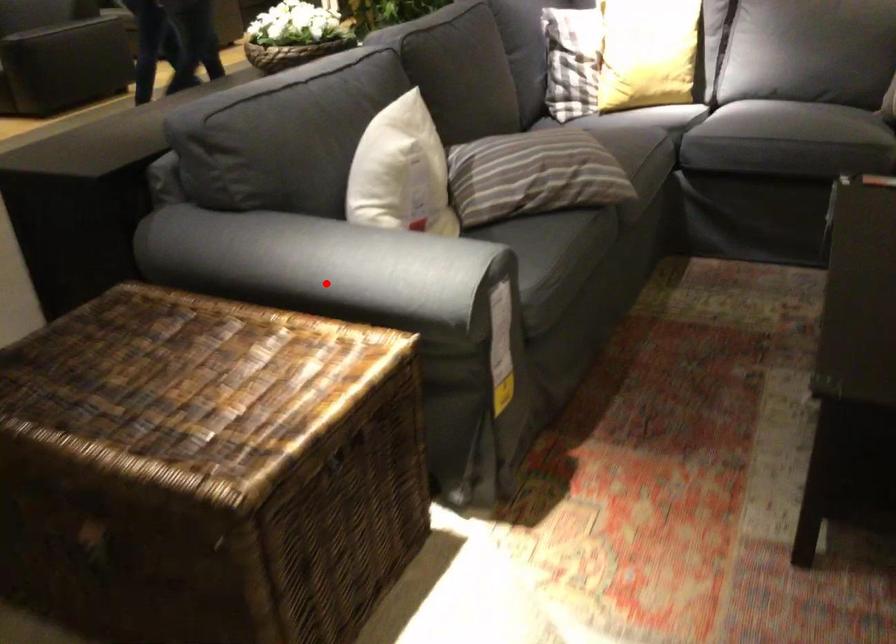
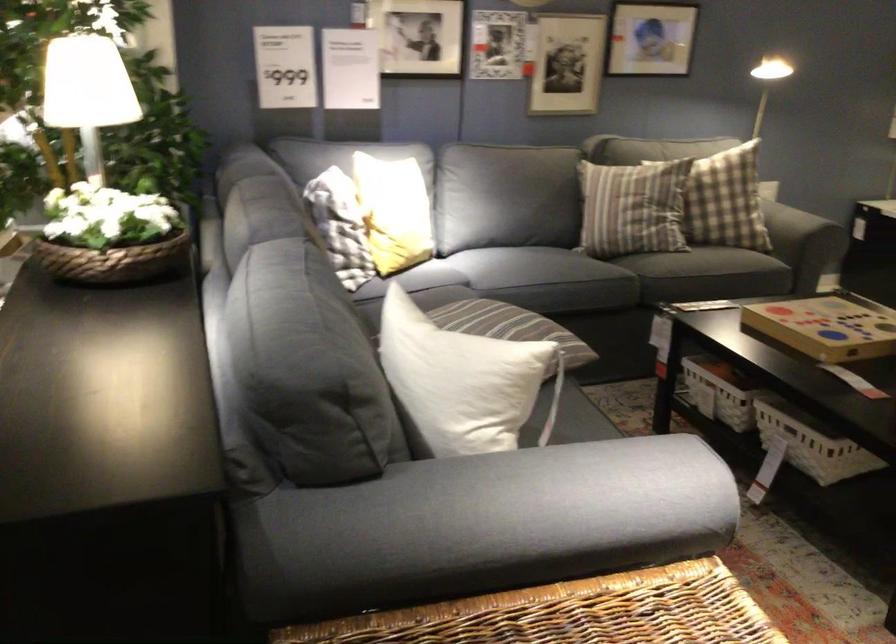
In the second image, find the point that corresponds to the highlighted location in the first image.

(528, 500)